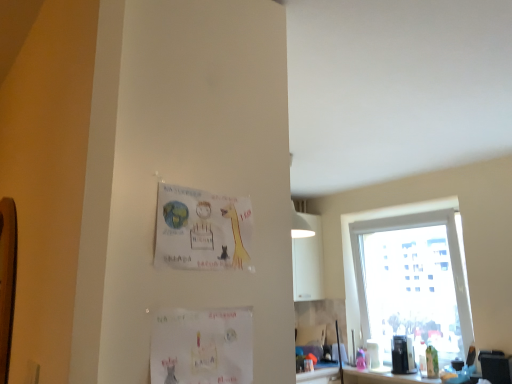
Question: From a real-world perspective, is white paper postcard at lower center, placed as the 2th postcard when sorted from top to bottom, physically below matte paper postcard at upper center, marked as the first postcard in a top-to-bottom arrangement?

Choices:
 (A) yes
 (B) no

Answer: (A)

Question: Considering the relative positions of white paper postcard at lower center, which is counted as the 1th postcard, starting from the bottom, and matte paper postcard at upper center, marked as the first postcard in a top-to-bottom arrangement, in the image provided, is white paper postcard at lower center, which is counted as the 1th postcard, starting from the bottom, in front of matte paper postcard at upper center, marked as the first postcard in a top-to-bottom arrangement,?

Choices:
 (A) no
 (B) yes

Answer: (B)

Question: From the image's perspective, is white paper postcard at lower center, which is counted as the 1th postcard, starting from the bottom, on matte paper postcard at upper center, marked as the first postcard in a top-to-bottom arrangement?

Choices:
 (A) yes
 (B) no

Answer: (B)

Question: Can you confirm if white paper postcard at lower center, placed as the 2th postcard when sorted from top to bottom, is wider than matte paper postcard at upper center, the second postcard ordered from the bottom?

Choices:
 (A) no
 (B) yes

Answer: (A)

Question: Is white paper postcard at lower center, placed as the 2th postcard when sorted from top to bottom, facing away from matte paper postcard at upper center, marked as the first postcard in a top-to-bottom arrangement?

Choices:
 (A) yes
 (B) no

Answer: (B)

Question: Is white paper postcard at lower center, placed as the 2th postcard when sorted from top to bottom, completely or partially outside of matte paper postcard at upper center, marked as the first postcard in a top-to-bottom arrangement?

Choices:
 (A) yes
 (B) no

Answer: (A)

Question: Can you confirm if transparent glass window at right is shorter than wooden bulletin board at left?

Choices:
 (A) no
 (B) yes

Answer: (A)

Question: Does transparent glass window at right lie behind wooden bulletin board at left?

Choices:
 (A) no
 (B) yes

Answer: (B)

Question: Considering the relative positions of transparent glass window at right and wooden bulletin board at left in the image provided, is transparent glass window at right in front of wooden bulletin board at left?

Choices:
 (A) no
 (B) yes

Answer: (A)

Question: Can wooden bulletin board at left be found inside transparent glass window at right?

Choices:
 (A) no
 (B) yes

Answer: (A)

Question: From a real-world perspective, is transparent glass window at right on wooden bulletin board at left?

Choices:
 (A) yes
 (B) no

Answer: (B)

Question: Is transparent glass window at right to the right of wooden bulletin board at left from the viewer's perspective?

Choices:
 (A) no
 (B) yes

Answer: (B)

Question: Considering the relative sizes of white paper postcard at lower center, placed as the 2th postcard when sorted from top to bottom, and transparent glass window at right in the image provided, is white paper postcard at lower center, placed as the 2th postcard when sorted from top to bottom, bigger than transparent glass window at right?

Choices:
 (A) yes
 (B) no

Answer: (B)